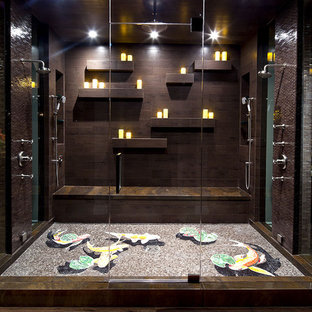
Where is `light source`? This screenshot has width=312, height=312. light source is located at coordinates 90,34, 154,33, 213,34.